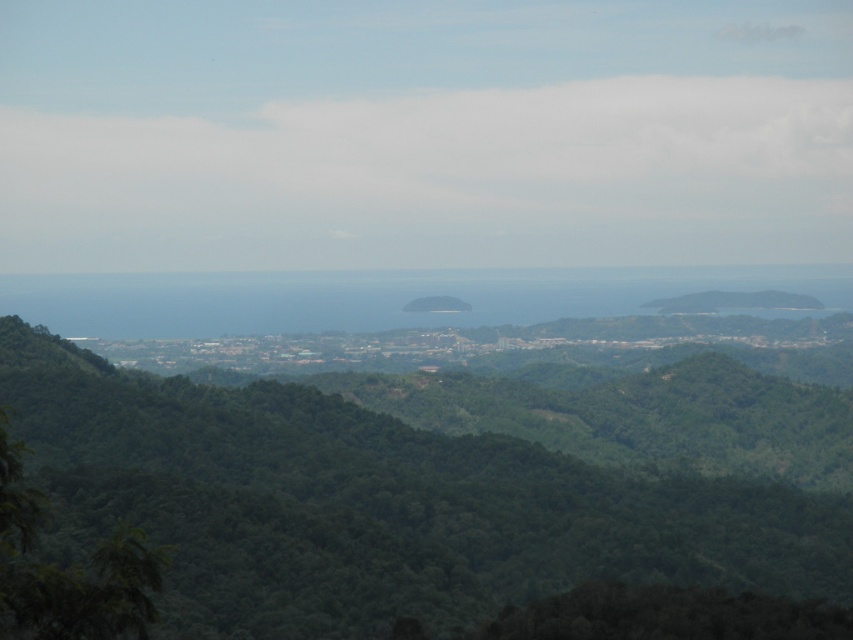
Question: Which point is farther to the camera?

Choices:
 (A) pos(42,522)
 (B) pos(515,513)

Answer: (B)

Question: Which of the following is the closest to the observer?

Choices:
 (A) green leafy trees at center
 (B) green leafy tree at lower left

Answer: (B)

Question: Can you confirm if green leafy trees at center is bigger than green leafy tree at lower left?

Choices:
 (A) yes
 (B) no

Answer: (A)

Question: Which object is farther from the camera taking this photo?

Choices:
 (A) green leafy trees at center
 (B) green leafy tree at lower left

Answer: (A)

Question: Can you confirm if green leafy trees at center is smaller than green leafy tree at lower left?

Choices:
 (A) no
 (B) yes

Answer: (A)

Question: Is green leafy trees at center positioned behind green leafy tree at lower left?

Choices:
 (A) yes
 (B) no

Answer: (A)